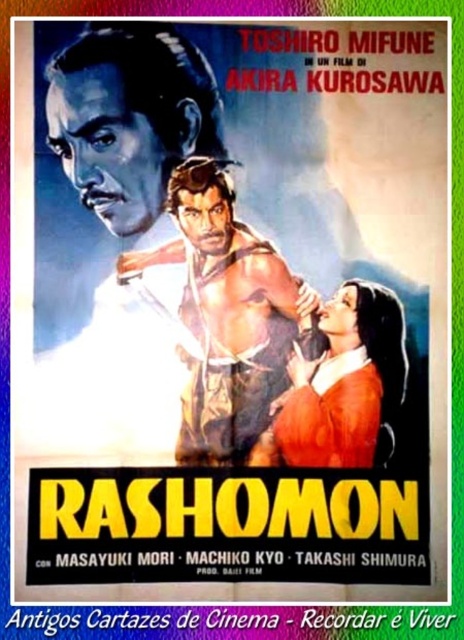
In the vintage movie poster for Rashomon, you see a muscular skin warrior at center and a smooth orange dress at center. Which object is positioned closer to the viewer?

The muscular skin warrior at center is closer to the viewer because the smooth orange dress at center is behind it.

In the vintage movie poster for Rashomon, there are two central elements depicted. One is the muscular skin warrior at center and the other is the smooth orange dress at center. Based on their sizes in the poster, which one do you think is more prominent and why?

The muscular skin warrior at center is more prominent because it has a larger size compared to the smooth orange dress at center.